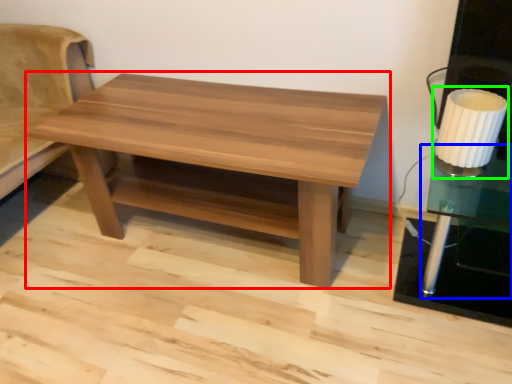
Question: Based on their relative distances, which object is nearer to coffee table (highlighted by a red box)? Choose from side table (highlighted by a blue box) and table lamp (highlighted by a green box).

Choices:
 (A) side table
 (B) table lamp

Answer: (B)